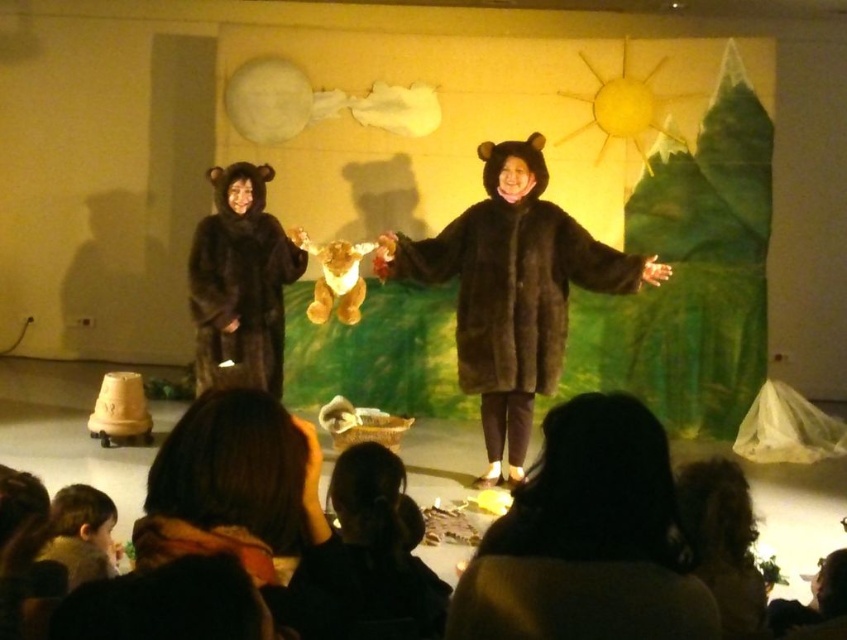
How distant is matte brown fur coat at center from fuzzy brown bear coat at left?

matte brown fur coat at center is 2.28 meters from fuzzy brown bear coat at left.

Between point (396, 147) and point (281, 358), which one is positioned behind?

The point (396, 147) is more distant.

Between point (388, 400) and point (242, 241), which one is positioned behind?

Point (388, 400)

Identify the location of matte brown fur coat at center. This screenshot has height=640, width=847. (438, 173).

Does matte brown fur coat at center have a smaller size compared to brown furry coat at center?

Yes.

Is point (637, 355) positioned before point (544, 364)?

No, it is behind (544, 364).

This screenshot has width=847, height=640. I want to click on matte brown fur coat at center, so click(x=438, y=173).

Who is positioned more to the right, dark brown fur coat at lower center or fuzzy brown bear coat at left?

From the viewer's perspective, dark brown fur coat at lower center appears more on the right side.

Does dark brown fur coat at lower center have a lesser width compared to fuzzy brown bear coat at left?

Indeed, dark brown fur coat at lower center has a lesser width compared to fuzzy brown bear coat at left.

Does point (557, 544) come behind point (267, 216)?

No, (557, 544) is in front of (267, 216).

Where is `dark brown fur coat at lower center`? The width and height of the screenshot is (847, 640). dark brown fur coat at lower center is located at coordinates (587, 540).